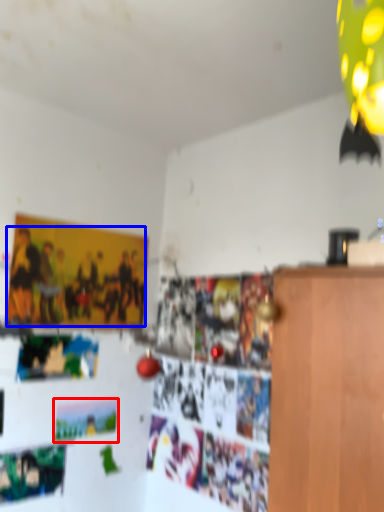
Question: Which object is further to the camera taking this photo, postcard (highlighted by a red box) or person (highlighted by a blue box)?

Choices:
 (A) postcard
 (B) person

Answer: (A)